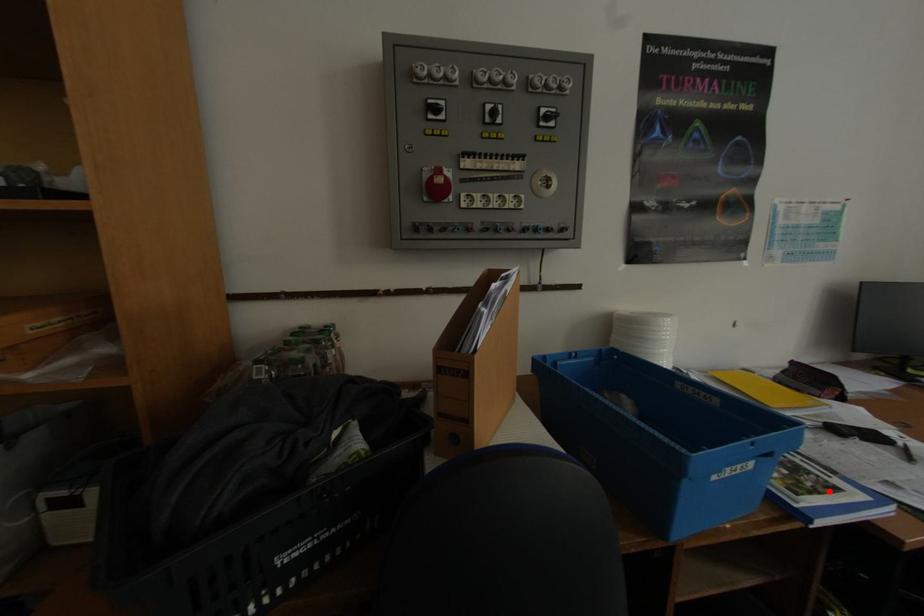
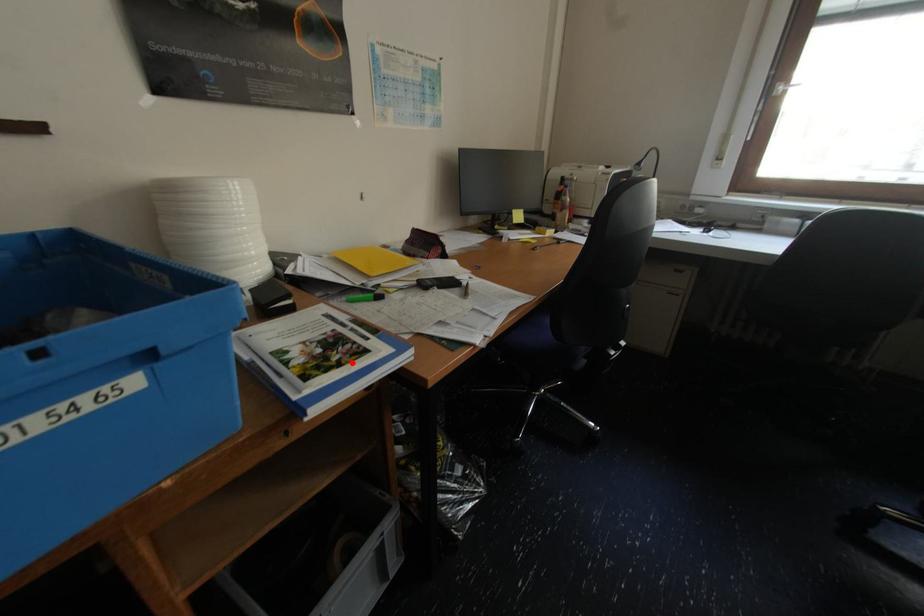
I am providing you with two images of the same scene from different viewpoints. A red point is marked on the first image and another point is marked on the second image. Does the point marked in image1 correspond to the same location as the one in image2?

Yes